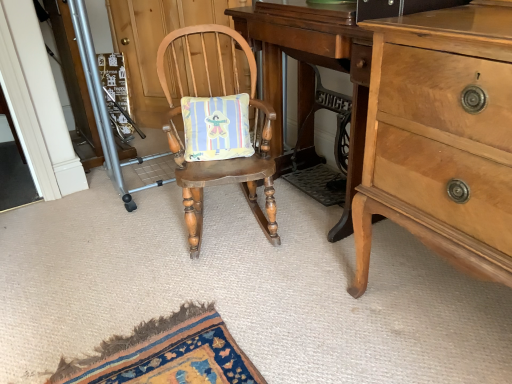
Where is `vacant region below light brown wood dresser at right (from a real-world perspective)`? This screenshot has width=512, height=384. vacant region below light brown wood dresser at right (from a real-world perspective) is located at coordinates click(450, 308).